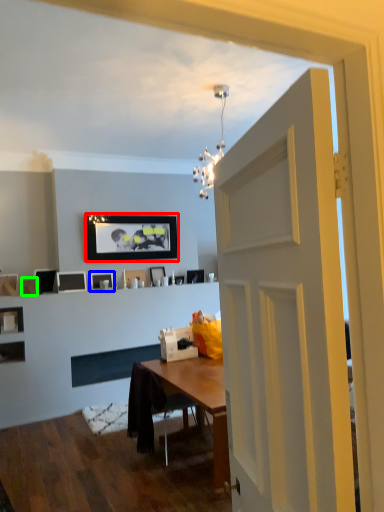
Question: Estimate the real-world distances between objects in this image. Which object is farther from picture frame (highlighted by a red box), picture frame (highlighted by a blue box) or picture frame (highlighted by a green box)?

Choices:
 (A) picture frame
 (B) picture frame

Answer: (B)